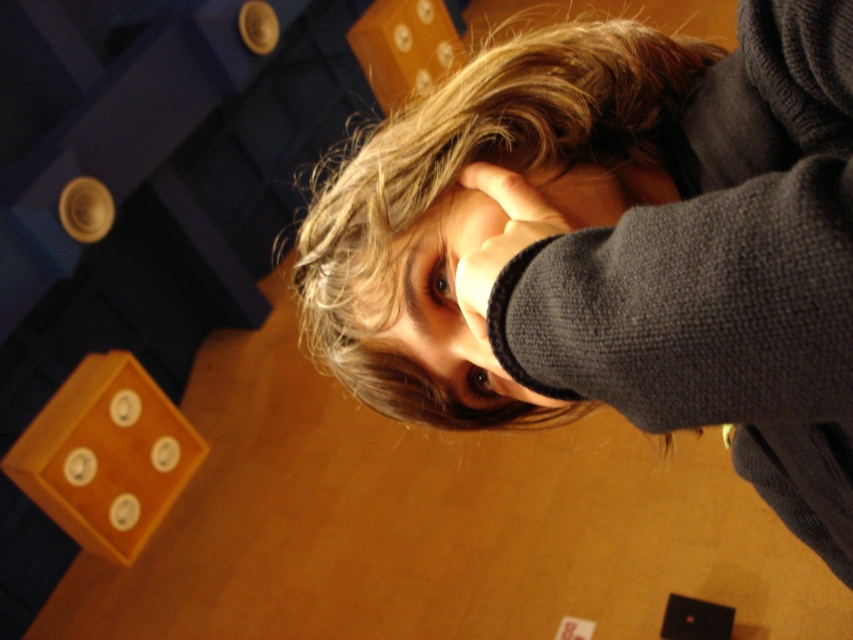
Question: Considering the relative positions of blonde textured hair at center and smooth skin face at center in the image provided, where is blonde textured hair at center located with respect to smooth skin face at center?

Choices:
 (A) left
 (B) right

Answer: (B)

Question: Which object is farther from the camera taking this photo?

Choices:
 (A) smooth skin face at center
 (B) dark gray knitted hand at center

Answer: (A)

Question: Considering the relative positions of blonde textured hair at center and dark gray knitted hand at center in the image provided, where is blonde textured hair at center located with respect to dark gray knitted hand at center?

Choices:
 (A) above
 (B) below

Answer: (B)

Question: Which of these objects is positioned closest to the dark gray knitted hand at center?

Choices:
 (A) smooth skin face at center
 (B) blonde textured hair at center

Answer: (A)

Question: Which of the following is the closest to the observer?

Choices:
 (A) (509, 189)
 (B) (440, 320)
 (C) (624, 113)

Answer: (A)

Question: Can you confirm if blonde textured hair at center is thinner than smooth skin face at center?

Choices:
 (A) yes
 (B) no

Answer: (B)